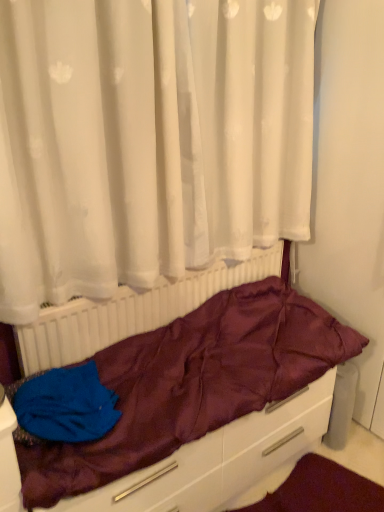
Question: Is there a large distance between blue fabric at lower left and white plastic radiator at center?

Choices:
 (A) yes
 (B) no

Answer: (B)

Question: From a real-world perspective, is blue fabric at lower left below white plastic radiator at center?

Choices:
 (A) no
 (B) yes

Answer: (B)

Question: Is blue fabric at lower left shorter than white plastic radiator at center?

Choices:
 (A) yes
 (B) no

Answer: (A)

Question: Is blue fabric at lower left bigger than white plastic radiator at center?

Choices:
 (A) yes
 (B) no

Answer: (B)

Question: Can you confirm if blue fabric at lower left is taller than white plastic radiator at center?

Choices:
 (A) no
 (B) yes

Answer: (A)

Question: Is blue fabric at lower left at the right side of white plastic radiator at center?

Choices:
 (A) yes
 (B) no

Answer: (B)

Question: From the image's perspective, is white plastic radiator at center beneath blue fabric at lower left?

Choices:
 (A) no
 (B) yes

Answer: (A)

Question: From the image's perspective, would you say white plastic radiator at center is positioned over blue fabric at lower left?

Choices:
 (A) yes
 (B) no

Answer: (A)

Question: Does white plastic radiator at center appear on the left side of blue fabric at lower left?

Choices:
 (A) no
 (B) yes

Answer: (A)

Question: Can you confirm if white plastic radiator at center is positioned to the right of blue fabric at lower left?

Choices:
 (A) no
 (B) yes

Answer: (B)

Question: Are white plastic radiator at center and blue fabric at lower left located far from each other?

Choices:
 (A) no
 (B) yes

Answer: (A)

Question: Is white plastic radiator at center shorter than blue fabric at lower left?

Choices:
 (A) yes
 (B) no

Answer: (B)

Question: From a real-world perspective, is blue fabric at lower left located beneath maroon satin sleeping bag at center?

Choices:
 (A) no
 (B) yes

Answer: (A)